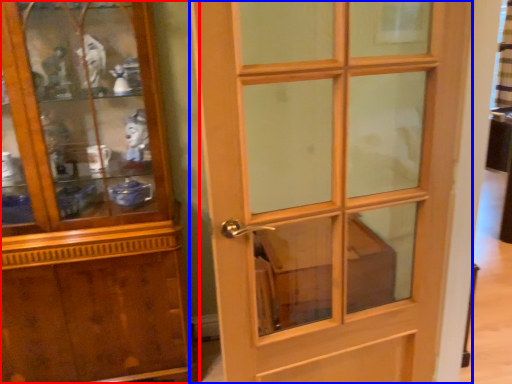
Question: Which point is closer to the camera, cupboard (highlighted by a red box) or door (highlighted by a blue box)?

Choices:
 (A) cupboard
 (B) door

Answer: (B)